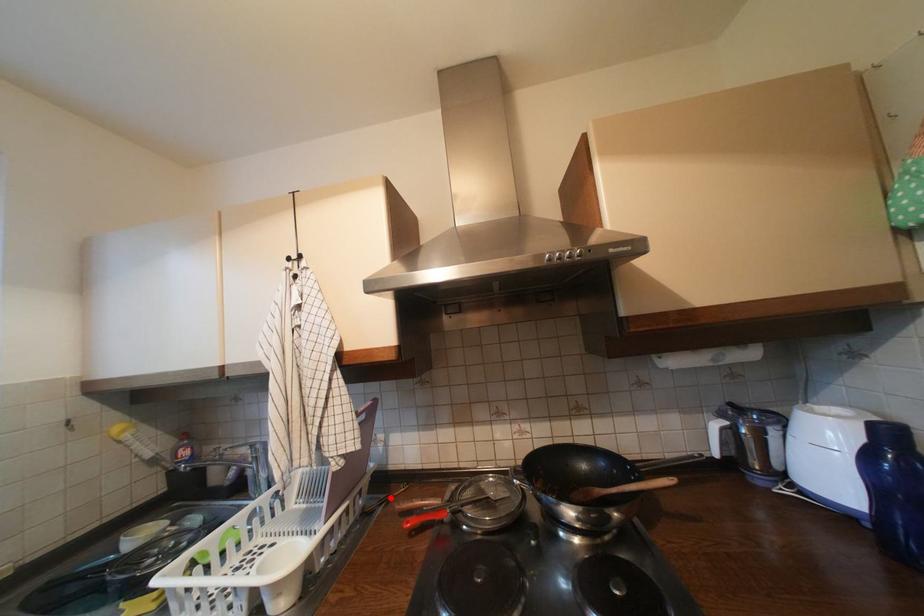
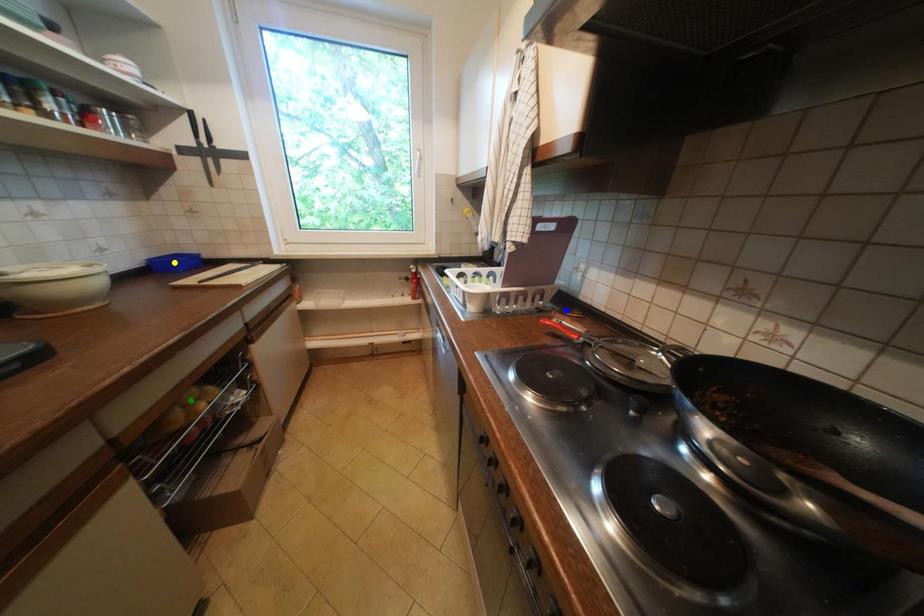
Question: I am providing you with two images of the same scene from different viewpoints. A red point is marked on the first image. You are given multiple points on the second image. Which point in image 2 represents the same 3d spot as the red point in image 1?

Choices:
 (A) blue point
 (B) green point
 (C) yellow point

Answer: (A)